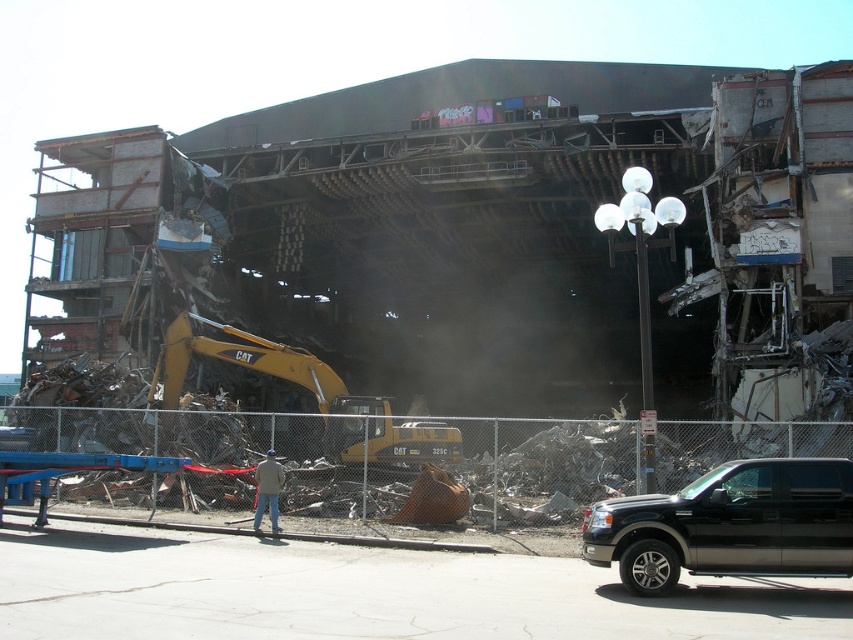
You are a construction worker standing next to the khaki fabric jacket at center. You need to move to the yellow metallic excavator at left to operate it. Can you walk directly to it without stepping over any obstacles?

The distance between the yellow metallic excavator at left and the khaki fabric jacket at center is 13.57 meters. Since the path is littered with rubble, metal scraps, and other construction materials, you would need to navigate around or over these obstacles to reach the excavator safely.

You are standing at the demolition site and want to place a safety barrier between the two points labeled point (689,512) and point (445,440). Which point should the barrier be closer to in order to block the path towards the excavator?

The barrier should be placed closer to point (689,512) because it is closer to the viewer than point (445,440), so positioning the barrier near the closer point would effectively block the path towards the excavator.

You are a safety inspector at the demolition site. You notice the yellow metallic excavator at left and the khaki fabric jacket at center. According to safety protocols, heavy machinery must stay at least 3 meters away from any unattended personal items. Is the excavator violating this rule?

The yellow metallic excavator at left is positioned over khaki fabric jacket at center, meaning it is directly above the jacket. Since the required distance is 3 meters and the excavator is right over it, this placement violates the safety protocol.